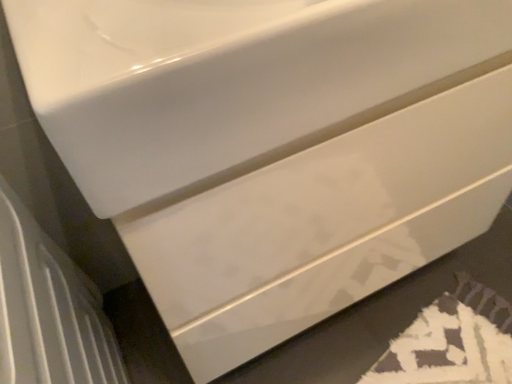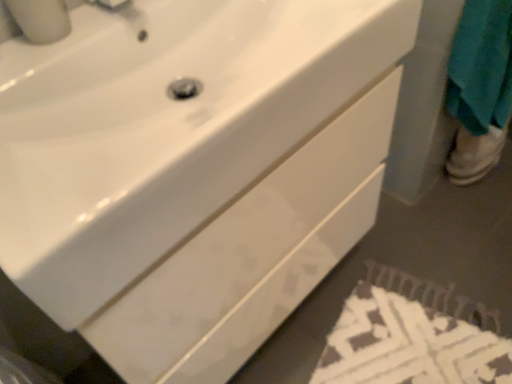
Question: How did the camera likely rotate when shooting the video?

Choices:
 (A) rotated left
 (B) rotated right

Answer: (B)